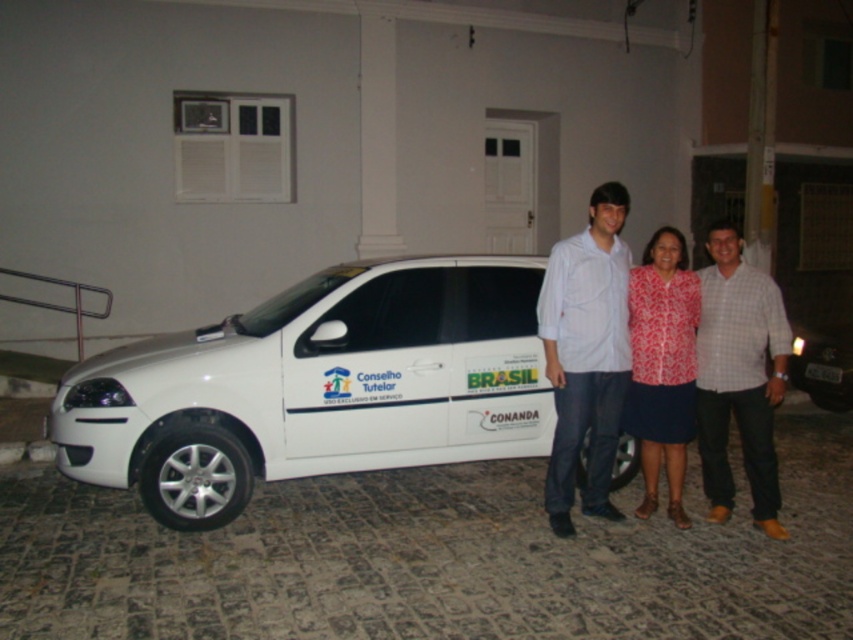
Question: Based on their relative distances, which object is nearer to the patterned fabric dress at center?

Choices:
 (A) white cotton shirt at center
 (B) white glossy sedan at right

Answer: (A)

Question: Is patterned fabric blouse at center above white glossy sedan at right?

Choices:
 (A) yes
 (B) no

Answer: (B)

Question: Can you confirm if patterned fabric dress at center is bigger than patterned fabric blouse at center?

Choices:
 (A) yes
 (B) no

Answer: (A)

Question: Which point is closer to the camera?

Choices:
 (A) patterned fabric blouse at center
 (B) patterned fabric dress at center

Answer: (B)

Question: Is patterned fabric dress at center smaller than white checkered shirt at center?

Choices:
 (A) yes
 (B) no

Answer: (B)

Question: Which point is closer to the camera taking this photo?

Choices:
 (A) (555, 353)
 (B) (572, 307)
 (C) (263, 413)
 (D) (838, 381)

Answer: (B)